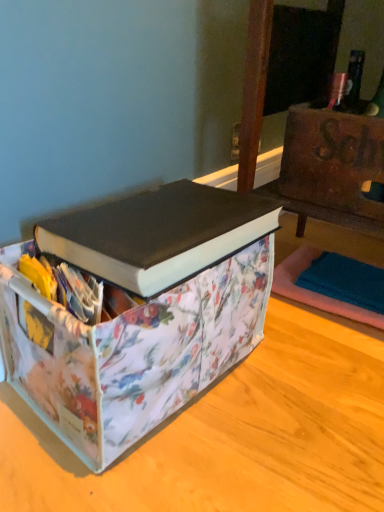
Locate an element on the screen. This screenshot has width=384, height=512. free space in front of floral fabric storage bin at center is located at coordinates (163, 467).